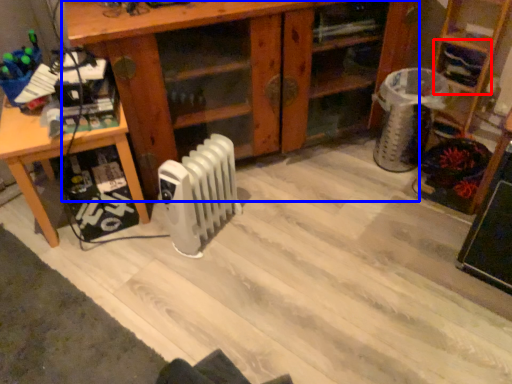
Question: Among these objects, which one is nearest to the camera, shelf (highlighted by a red box) or shelf (highlighted by a blue box)?

Choices:
 (A) shelf
 (B) shelf

Answer: (B)